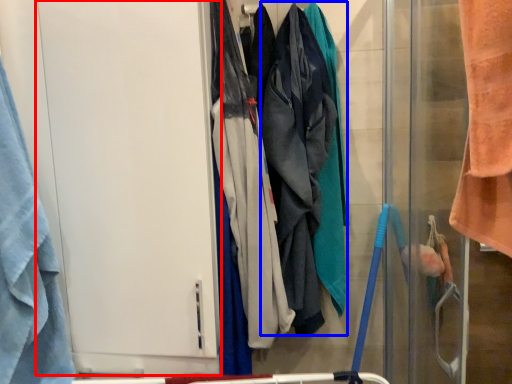
Question: Which object appears farthest to the camera in this image, screen door (highlighted by a red box) or wide (highlighted by a blue box)?

Choices:
 (A) screen door
 (B) wide

Answer: (B)